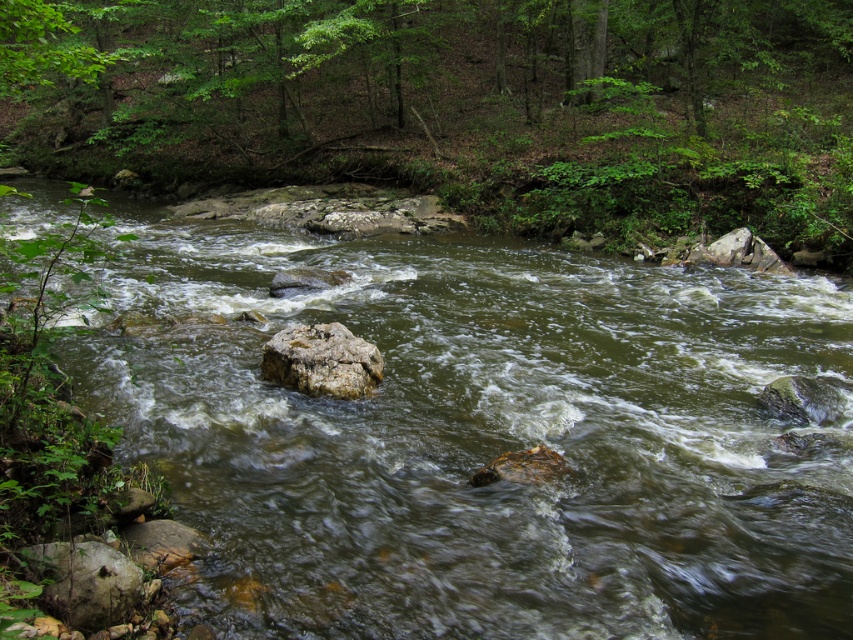
The width and height of the screenshot is (853, 640). Identify the location of green mossy rock at center. (482, 440).

Image resolution: width=853 pixels, height=640 pixels. Identify the location of green mossy rock at center. (482, 440).

Does green mossy rock at center appear over rough textured rock at center?

Indeed, green mossy rock at center is positioned over rough textured rock at center.

Is point (270, 561) more distant than point (338, 372)?

No, (270, 561) is closer to viewer.

Who is more forward, (675, 589) or (349, 390)?

Positioned in front is point (675, 589).

The height and width of the screenshot is (640, 853). What are the coordinates of `green mossy rock at center` in the screenshot? It's located at (482, 440).

Between point (537, 534) and point (45, 604), which one is positioned in front?

Point (45, 604) is more forward.

Locate an element on the screen. This screenshot has height=640, width=853. green mossy rock at center is located at coordinates (482, 440).

Where is `green mossy rock at center`? The height and width of the screenshot is (640, 853). green mossy rock at center is located at coordinates (482, 440).